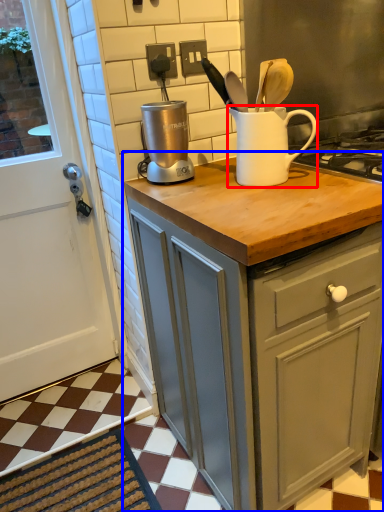
Question: Which of the following is the farthest to the observer, jug (highlighted by a red box) or cabinetry (highlighted by a blue box)?

Choices:
 (A) jug
 (B) cabinetry

Answer: (A)